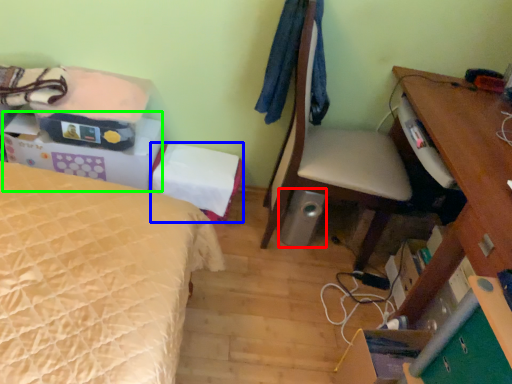
Question: Based on their relative distances, which object is farther from loudspeaker (highlighted by a red box)? Choose from storage box (highlighted by a blue box) and storage box (highlighted by a green box).

Choices:
 (A) storage box
 (B) storage box

Answer: (B)